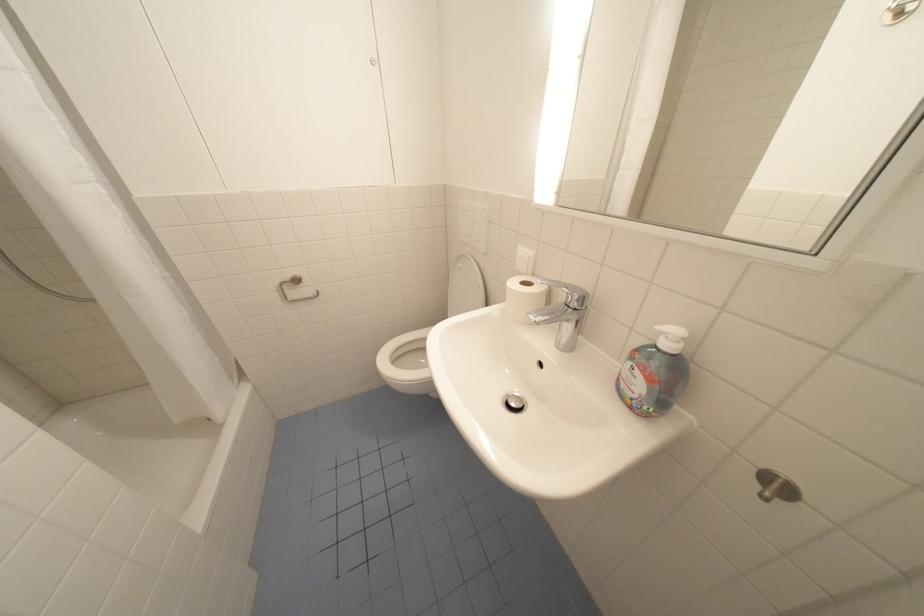
The width and height of the screenshot is (924, 616). What do you see at coordinates (671, 342) in the screenshot? I see `the soap dispenser pump` at bounding box center [671, 342].